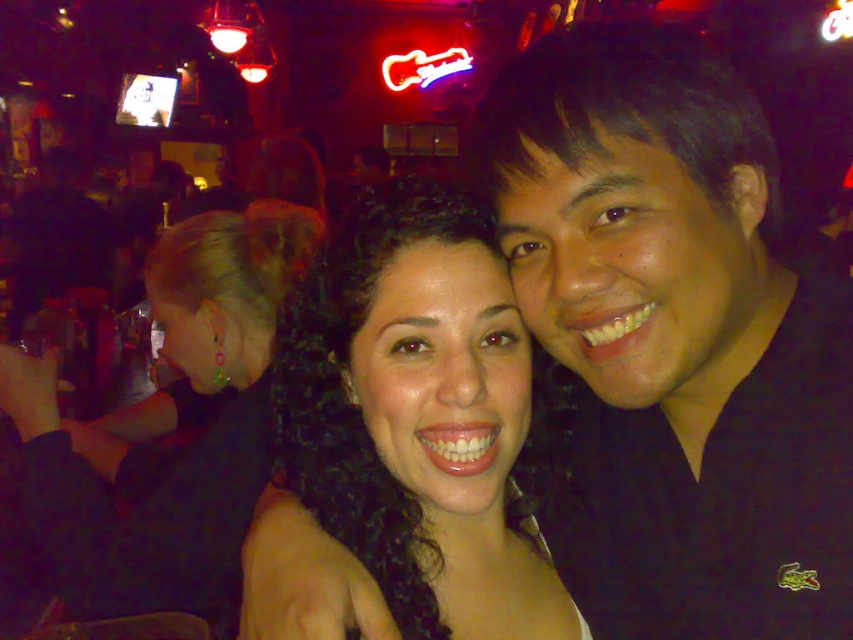
You are a photographer adjusting the focus on your camera. You want to ensure that both the black matte shirt at center and the matte black hair at center are in sharp focus. Given their positions, which object should you focus on first to achieve this?

You should focus on the black matte shirt at center first because it is closer to the viewer than the matte black hair at center. By focusing on the closer object, you can ensure that both are within the depth of field for sharpness.